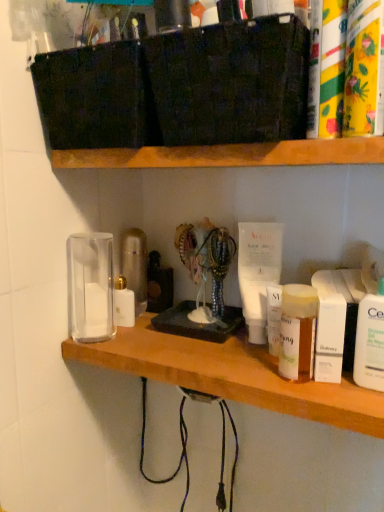
Locate an element on the screen. empty space that is ontop of clear glass jar at center, acting as the 2th shelf starting from the top (from a real-world perspective) is located at coordinates (210, 346).